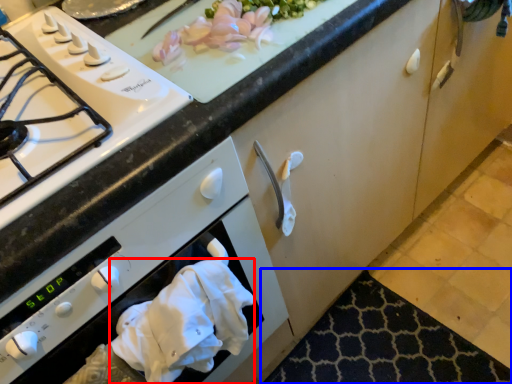
Question: Which object appears farthest to the camera in this image, hand towel (highlighted by a red box) or mat (highlighted by a blue box)?

Choices:
 (A) hand towel
 (B) mat

Answer: (B)